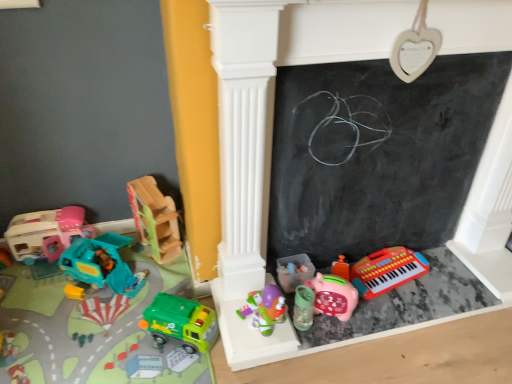
Locate an element on the screen. This screenshot has height=384, width=512. free region on the left part of green plastic toy truck at lower left, the fourth toy positioned from the left is located at coordinates coord(130,339).